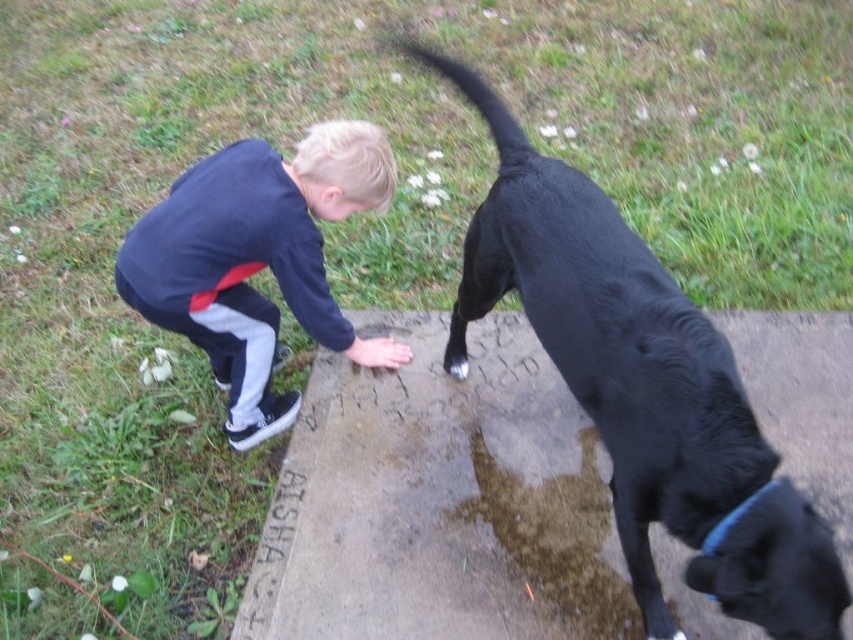
Describe the element at coordinates (642, 388) in the screenshot. This screenshot has width=853, height=640. I see `black smooth dog at lower right` at that location.

Between point (572, 308) and point (144, 275), which one is positioned behind?

Point (144, 275)

Where is `black smooth dog at lower right`? black smooth dog at lower right is located at coordinates (642, 388).